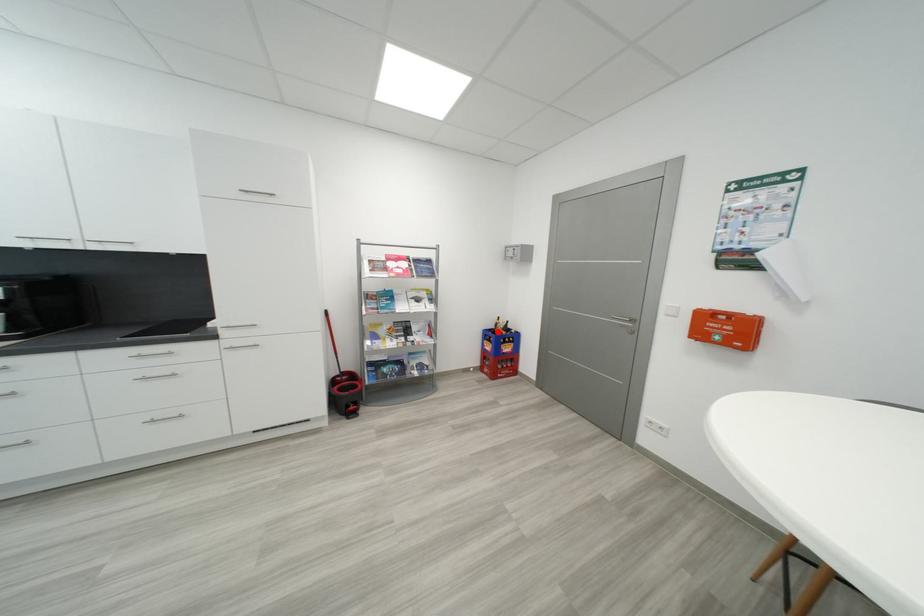
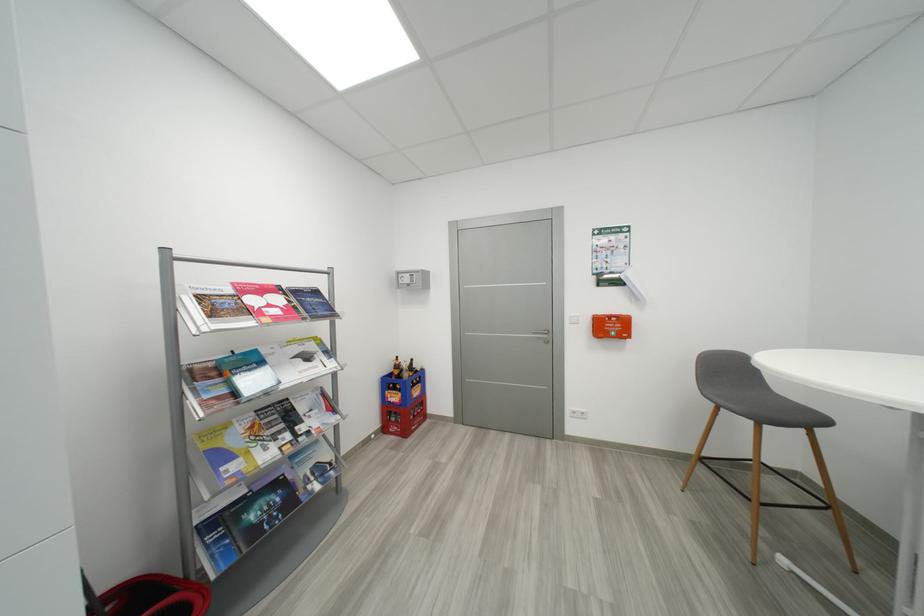
Question: I am providing you with two images of the same scene from different viewpoints. A red point is marked on the first image. At the location where the point appears in image 1, is it still visible in image 2?

Choices:
 (A) Yes
 (B) No

Answer: (A)